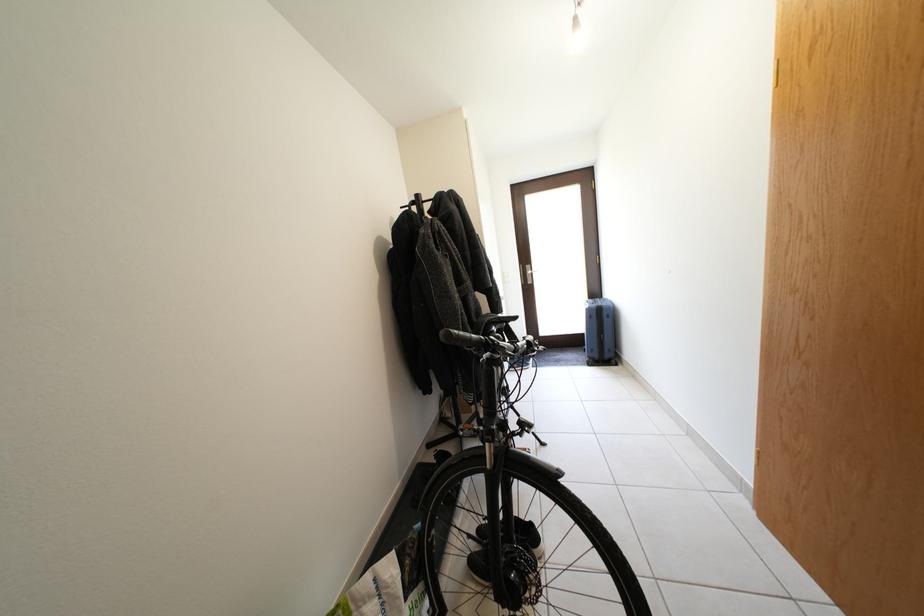
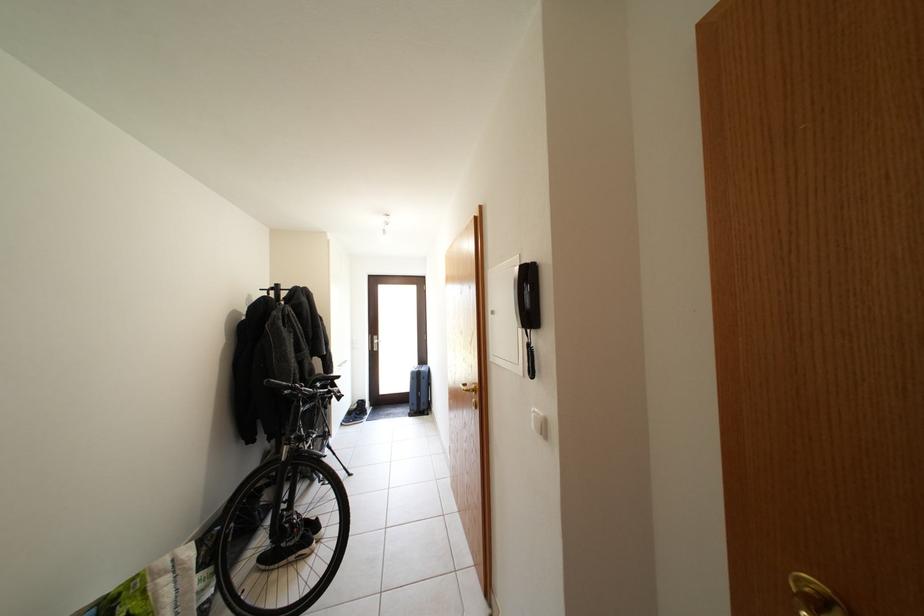
Where in the second image is the point corresponding to (x=598, y=315) from the first image?

(420, 379)